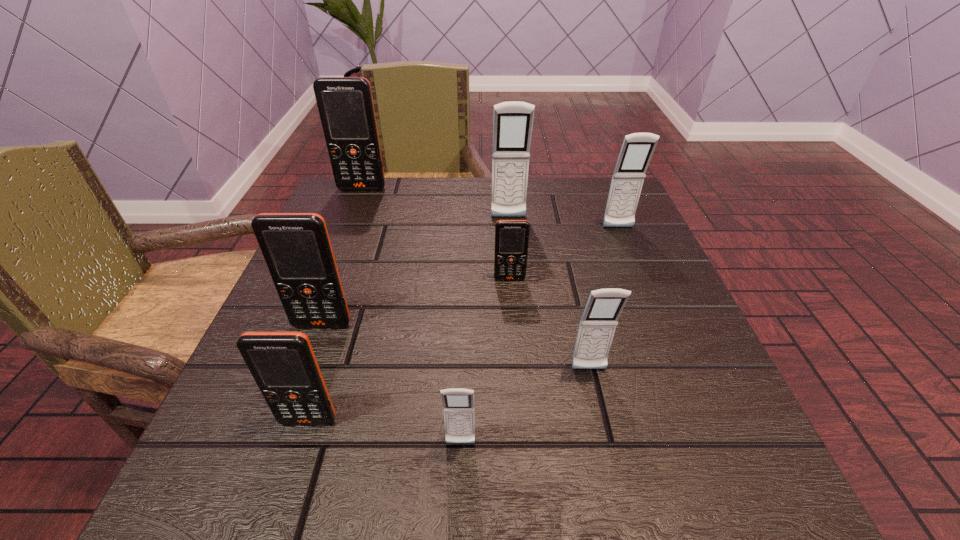
Find the location of a particular element. The width and height of the screenshot is (960, 540). the farthest orange cellular telephone is located at coordinates (345, 104).

The width and height of the screenshot is (960, 540). In order to click on the farthest object in this screenshot , I will do `click(345, 104)`.

Identify the location of the seventh nearest cellular telephone. The width and height of the screenshot is (960, 540). (512, 124).

This screenshot has width=960, height=540. Find the location of `the biggest gray cellular telephone`. the biggest gray cellular telephone is located at coordinates (512, 124).

Where is `the third smallest gray cellular telephone`? The image size is (960, 540). the third smallest gray cellular telephone is located at coordinates (637, 149).

The width and height of the screenshot is (960, 540). Find the location of `the second farthest gray cellular telephone`. the second farthest gray cellular telephone is located at coordinates (637, 149).

The image size is (960, 540). In order to click on the third smallest orange cellular telephone in this screenshot , I will do `click(296, 247)`.

Where is `the fifth farthest cellular telephone`? The height and width of the screenshot is (540, 960). the fifth farthest cellular telephone is located at coordinates (296, 247).

I want to click on the second gray cellular telephone from right to left, so click(x=598, y=323).

Where is `the second object from right to left`? This screenshot has width=960, height=540. the second object from right to left is located at coordinates (598, 323).